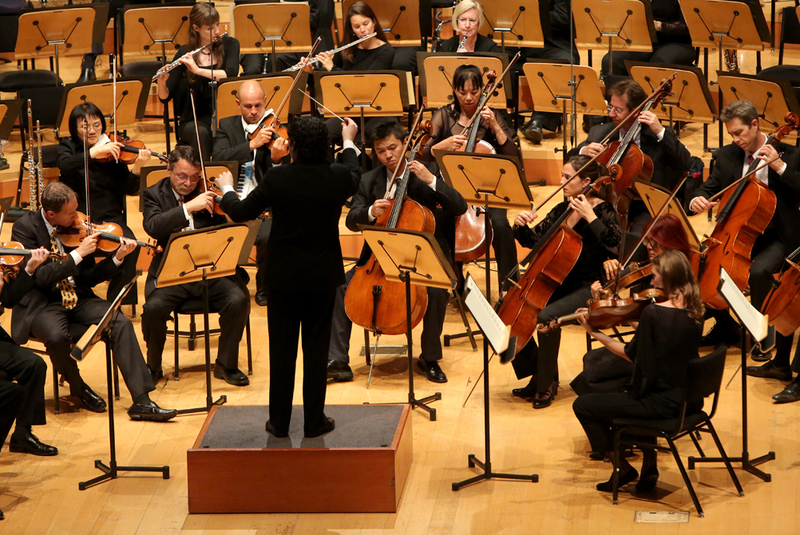
This screenshot has height=535, width=800. I want to click on music stands in back row, so click(x=61, y=22), click(x=154, y=24), click(x=261, y=18), click(x=386, y=15), click(x=501, y=7), click(x=601, y=18), click(x=712, y=13).